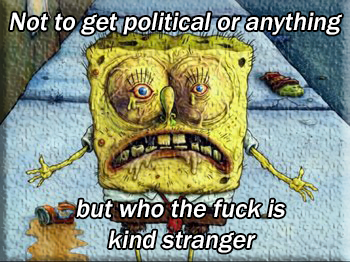
Identify the location of cement tiles. The image size is (350, 262). (211, 5), (260, 45), (290, 133).